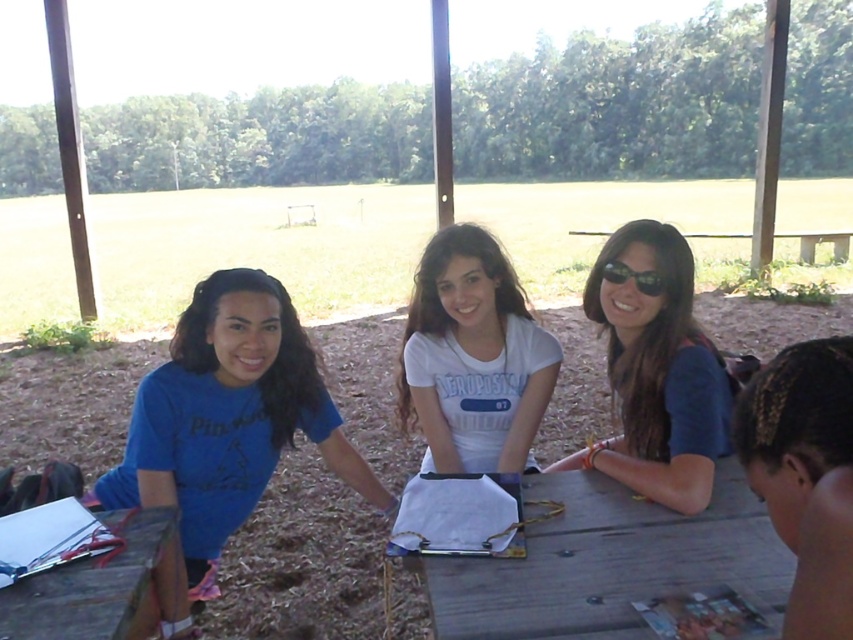
You are standing at the picnic table and want to reach the point marked at coordinates [209,465]. Can you comfortably reach it without moving your feet?

The point at coordinates [209,465] is 5.86 feet away from the viewer. Since this distance is within a typical comfortable reaching range of about 6 feet, you can comfortably reach it without moving your feet.

You are planning to take a photo of the blue matte shirt at left and the wooden picnic table at lower left. Which object should you zoom in more on to ensure both are clearly visible in the frame?

You should zoom in more on the wooden picnic table at lower left because the blue matte shirt at left is bigger than the wooden picnic table at lower left, so the shirt will take up more space in the frame and may require less zoom to be visible.